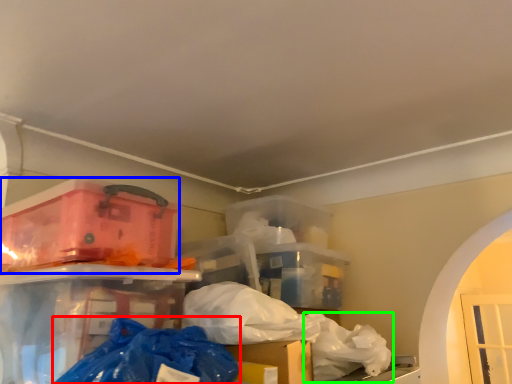
Question: Which object is the closest to the plastic bag (highlighted by a red box)? Choose among these: box (highlighted by a blue box) or plastic bag (highlighted by a green box).

Choices:
 (A) box
 (B) plastic bag

Answer: (A)